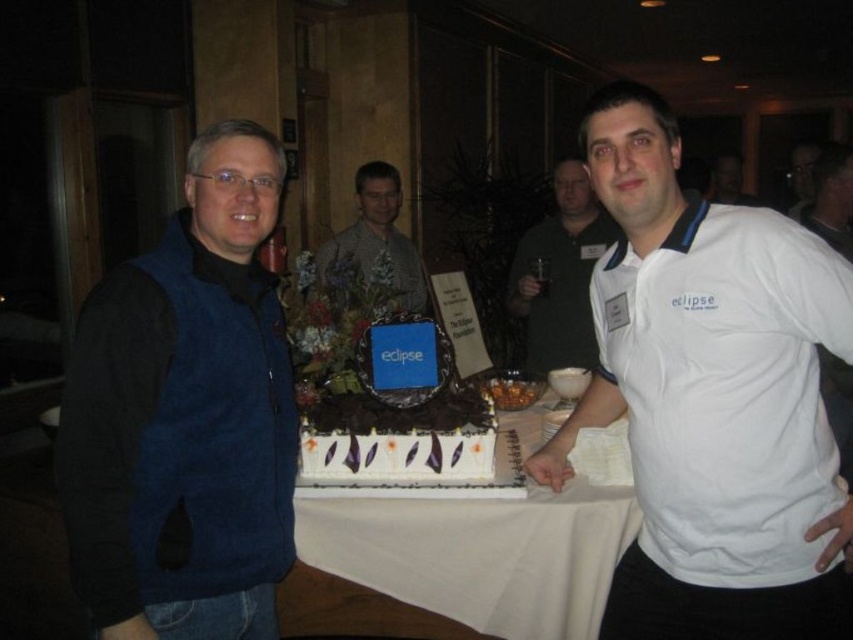
You are a photographer at the event and need to adjust the lighting to focus on the white cotton shirt at center. Based on the coordinates provided in the Objects Description, where should you position the spotlight relative to the shirt?

The white cotton shirt at center is located at point (x=712, y=397), so the spotlight should be positioned directly above or slightly behind the shirt to ensure proper illumination without casting shadows.

You are at a party and want to introduce yourself to both the person wearing the blue fleece vest at left and the individual in the white shirt at center. Since you want to greet them in the order they are positioned from left to right, which person should you approach first?

The blue fleece vest at left is located below white shirt at center, so the person wearing the blue fleece vest at left is positioned to the left. Therefore, you should approach the person wearing the blue fleece vest at left first as they are on the left side.

You are a photographer at a social event and need to adjust the lighting so that both the white cotton shirt at center and the blue fleece vest at left are equally visible. Which object should you focus on first to ensure proper exposure?

The white cotton shirt at center is positioned over the blue fleece vest at left, so focusing on the blue fleece vest at left first would help balance the exposure since it is underneath and might receive less light.